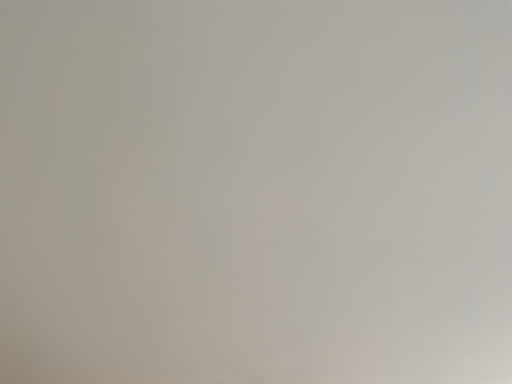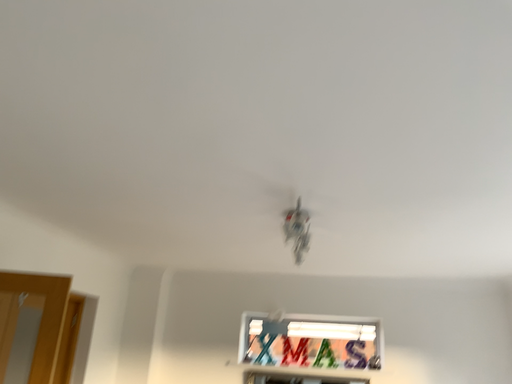
Question: How did the camera likely rotate when shooting the video?

Choices:
 (A) rotated upward
 (B) rotated downward

Answer: (B)